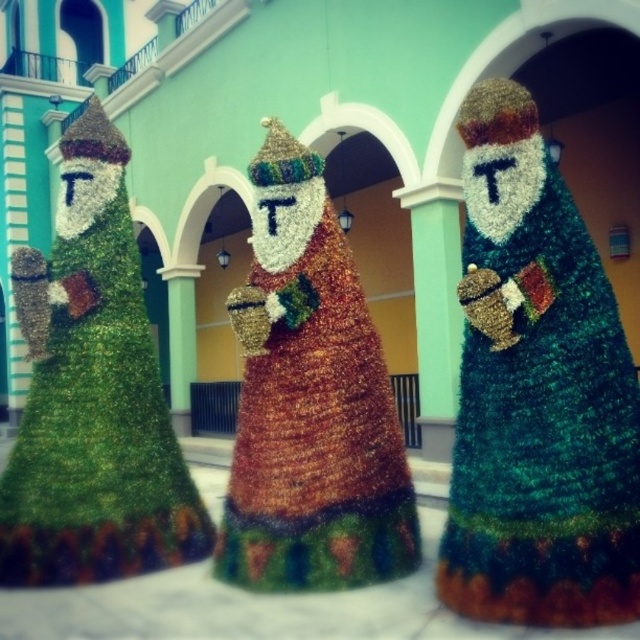
Does green textured santa claus at center have a greater width compared to gold textured santa claus at center?

No, green textured santa claus at center is not wider than gold textured santa claus at center.

This screenshot has height=640, width=640. Describe the element at coordinates (536, 394) in the screenshot. I see `green textured santa claus at center` at that location.

Locate an element on the screen. This screenshot has height=640, width=640. green textured santa claus at center is located at coordinates (536, 394).